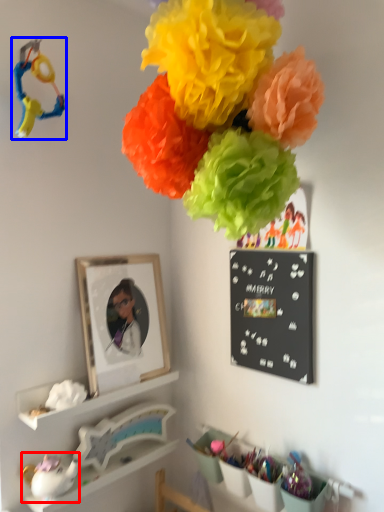
Question: Which object appears closest to the camera in this image, toy (highlighted by a red box) or toy (highlighted by a blue box)?

Choices:
 (A) toy
 (B) toy

Answer: (B)